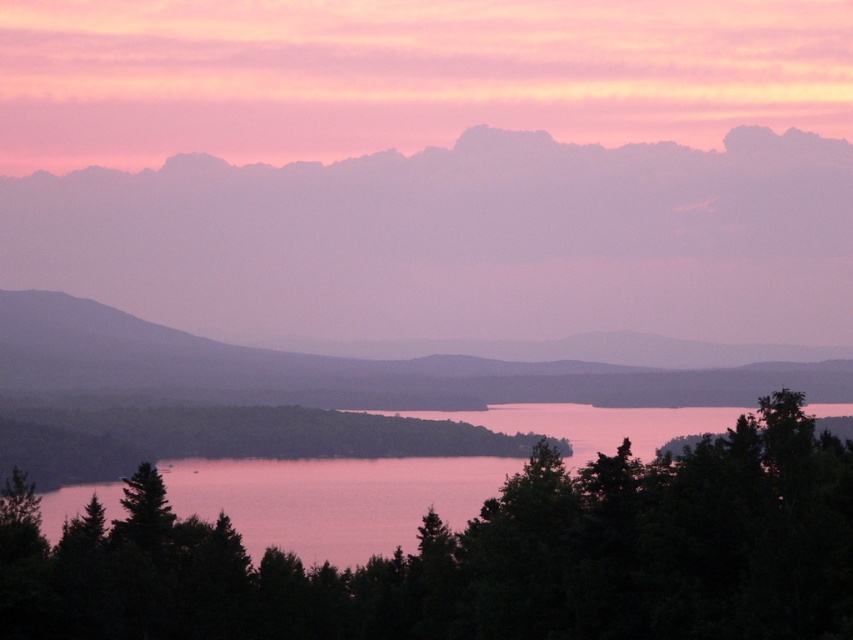
Question: Which of the following is the closest to the observer?

Choices:
 (A) (38, 358)
 (B) (202, 554)
 (C) (347, 33)

Answer: (B)

Question: Does pink matte cloud at upper center have a lesser width compared to smooth purple mountain at left?

Choices:
 (A) no
 (B) yes

Answer: (A)

Question: Among these objects, which one is nearest to the camera?

Choices:
 (A) pink matte cloud at upper center
 (B) purple foggy cloud at upper center
 (C) green matte tree at center

Answer: (C)

Question: Does pink matte cloud at upper center have a greater width compared to smooth purple mountain at left?

Choices:
 (A) no
 (B) yes

Answer: (B)

Question: Is green matte tree at center to the left of smooth purple mountain at left from the viewer's perspective?

Choices:
 (A) no
 (B) yes

Answer: (B)

Question: Based on their relative distances, which object is farther from the green matte tree at center?

Choices:
 (A) purple foggy cloud at upper center
 (B) smooth purple mountain at left
 (C) pink matte cloud at upper center

Answer: (C)